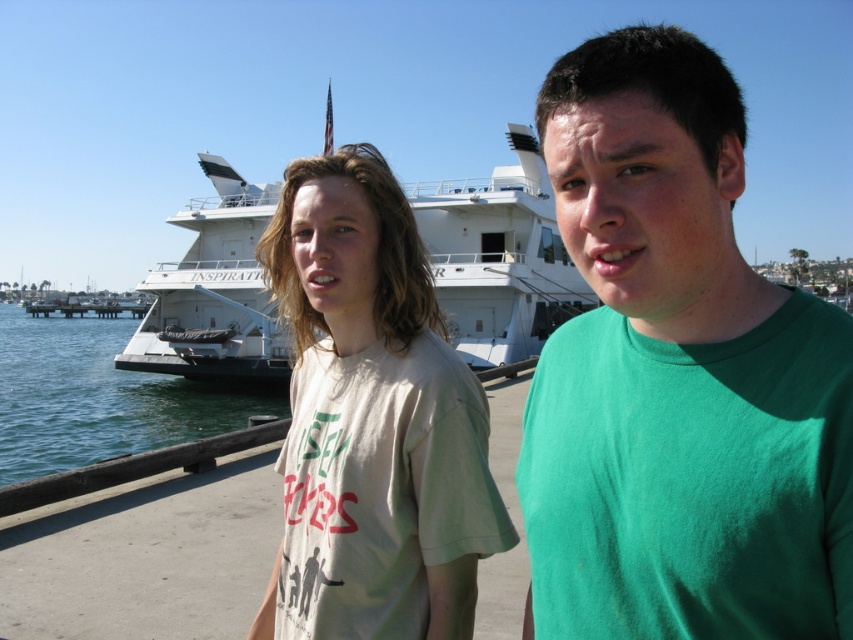
You are standing at the waterfront and want to reach the point marked as point (662,264). If you walk straight ahead, how far will you have to walk to reach that point?

The distance between you and point (662,264) is 10.47 feet, so you will have to walk 10.47 feet straight ahead to reach it.

From the picture: You are a photographer taking a picture of the green matte shirt at center and the clear blue water at lower left. Which object will appear larger in the photo?

The green matte shirt at center appears larger in the photo because it is closer to the viewer than the clear blue water at lower left.